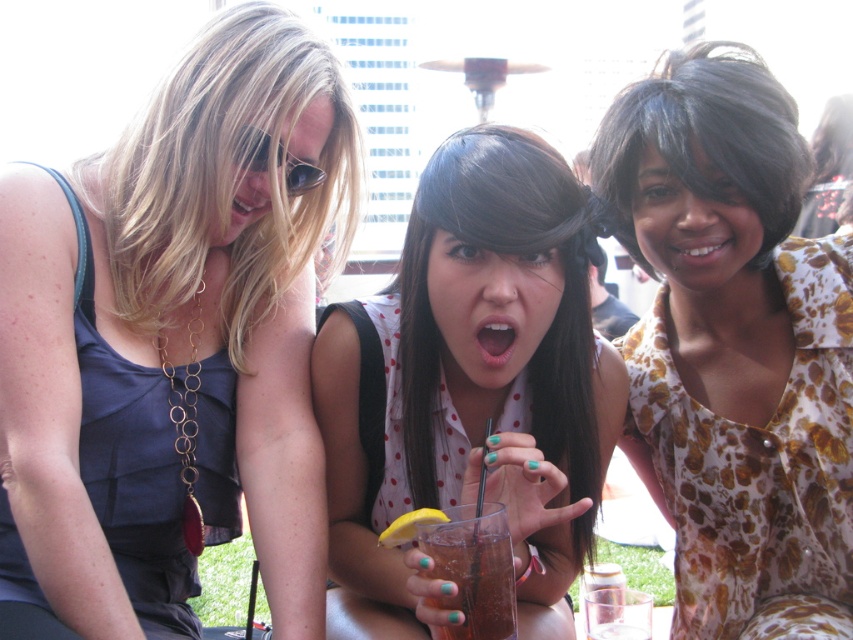
Question: Can you confirm if dark brown hair at upper right is positioned to the left of white glossy teeth at center?

Choices:
 (A) no
 (B) yes

Answer: (B)

Question: Which object is the farthest from the matte skin at center?

Choices:
 (A) dark brown hair at upper right
 (B) floral print dress at center
 (C) teethsmoothmouth at center

Answer: (B)

Question: Can you confirm if sunglasses at upper left is smaller than teethsmoothmouth at center?

Choices:
 (A) no
 (B) yes

Answer: (A)

Question: Which point is farther to the camera?

Choices:
 (A) translucent glass drink at center
 (B) polka dot blouse at center
 (C) floral print dress at center
 (D) sunglasses at upper left

Answer: (C)

Question: Can you confirm if matte black dress at left is positioned above polka dot blouse at center?

Choices:
 (A) yes
 (B) no

Answer: (A)

Question: Which point is farther to the camera?

Choices:
 (A) polka dot blouse at center
 (B) matte black dress at left
 (C) white glossy teeth at center
 (D) dark brown hair at upper right

Answer: (C)